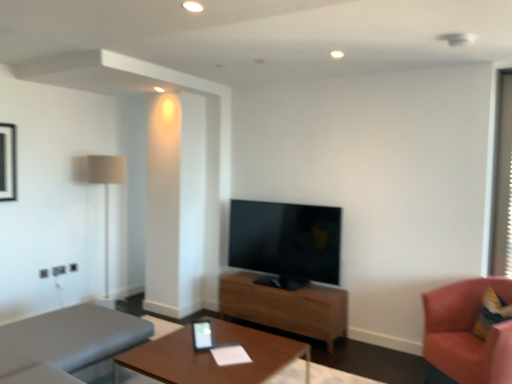
Question: Is wooden table at center, which appears as the 1th table when viewed from the back, oriented towards black glossy picture frame at upper left?

Choices:
 (A) no
 (B) yes

Answer: (A)

Question: Is wooden table at center, the second table in the front-to-back sequence, wider than black glossy picture frame at upper left?

Choices:
 (A) no
 (B) yes

Answer: (B)

Question: Does wooden table at center, which appears as the 1th table when viewed from the back, have a lesser width compared to black glossy picture frame at upper left?

Choices:
 (A) no
 (B) yes

Answer: (A)

Question: Is wooden table at center, the second table in the front-to-back sequence, beside black glossy picture frame at upper left?

Choices:
 (A) no
 (B) yes

Answer: (A)

Question: From a real-world perspective, is wooden table at center, which appears as the 1th table when viewed from the back, positioned over black glossy picture frame at upper left based on gravity?

Choices:
 (A) yes
 (B) no

Answer: (B)

Question: Is wooden table at center, which appears as the 1th table when viewed from the back, not within black glossy picture frame at upper left?

Choices:
 (A) yes
 (B) no

Answer: (A)

Question: Is pink fabric chair at right not inside wooden table at center, acting as the second table starting from the back?

Choices:
 (A) no
 (B) yes

Answer: (B)

Question: Does pink fabric chair at right have a greater height compared to wooden table at center, acting as the second table starting from the back?

Choices:
 (A) yes
 (B) no

Answer: (A)

Question: Is pink fabric chair at right not close to wooden table at center, the first table viewed from the front?

Choices:
 (A) no
 (B) yes

Answer: (B)

Question: Considering the relative sizes of pink fabric chair at right and wooden table at center, acting as the second table starting from the back, in the image provided, is pink fabric chair at right smaller than wooden table at center, acting as the second table starting from the back,?

Choices:
 (A) yes
 (B) no

Answer: (B)

Question: Can you confirm if pink fabric chair at right is positioned to the left of wooden table at center, the first table viewed from the front?

Choices:
 (A) no
 (B) yes

Answer: (A)

Question: From a real-world perspective, is pink fabric chair at right over wooden table at center, the first table viewed from the front?

Choices:
 (A) yes
 (B) no

Answer: (A)

Question: Can you confirm if black glossy picture frame at upper left is positioned to the right of gray fabric studio couch at lower left?

Choices:
 (A) yes
 (B) no

Answer: (B)